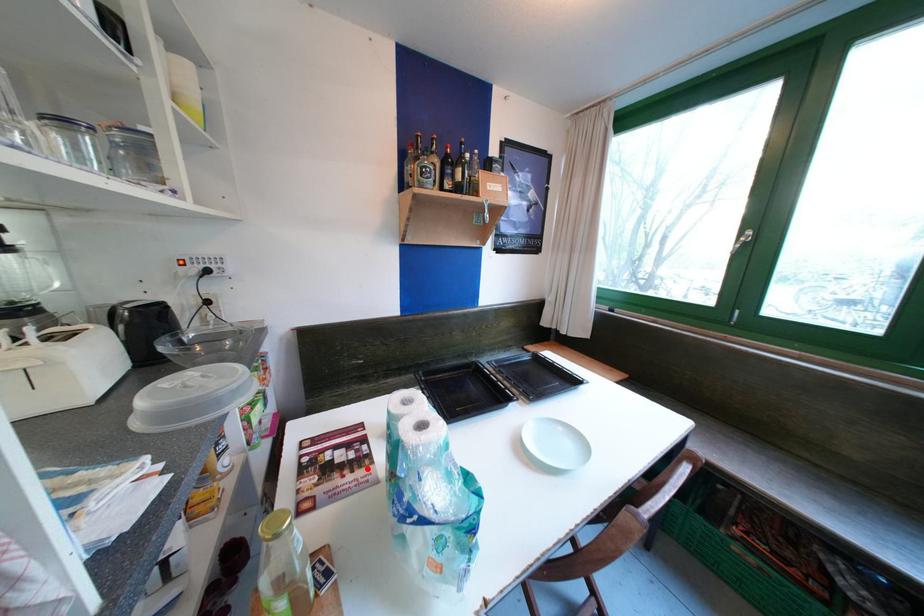
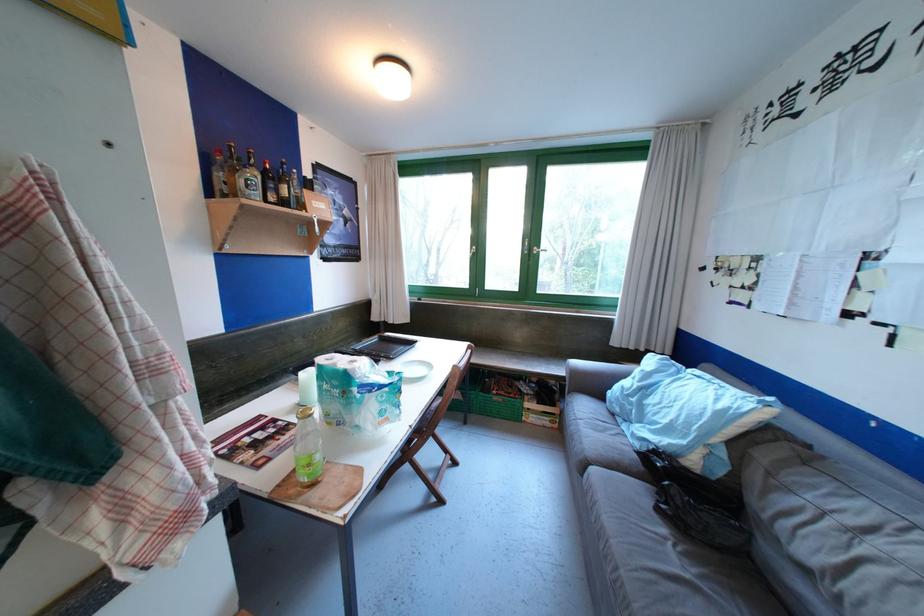
Question: I am providing you with two images of the same scene from different viewpoints. A red point is shown in image1. For the corresponding object point in image2, is it positioned nearer or farther from the camera?

Choices:
 (A) Nearer
 (B) Farther

Answer: (A)